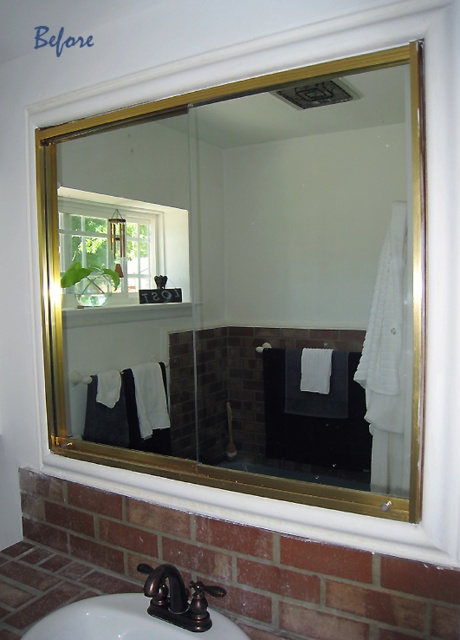
Question: Can you confirm if oil rubbed bronze faucet at lower center is smaller than white matte towel bar at center?

Choices:
 (A) no
 (B) yes

Answer: (A)

Question: Which point is farther to the camera?

Choices:
 (A) (269, 432)
 (B) (258, 348)

Answer: (B)

Question: Which object appears farthest from the camera in this image?

Choices:
 (A) white fabric towel bar at center
 (B) white matte towel bar at center

Answer: (A)

Question: Estimate the real-world distances between objects in this image. Which object is closer to the gold metallic mirror at upper center?

Choices:
 (A) white matte towel bar at center
 (B) oil rubbed bronze faucet at lower center

Answer: (A)

Question: Can you confirm if matte black faucet at lower center is positioned to the left of oil rubbed bronze faucet at lower center?

Choices:
 (A) no
 (B) yes

Answer: (B)

Question: Is matte black faucet at lower center wider than white fabric towel bar at center?

Choices:
 (A) no
 (B) yes

Answer: (B)